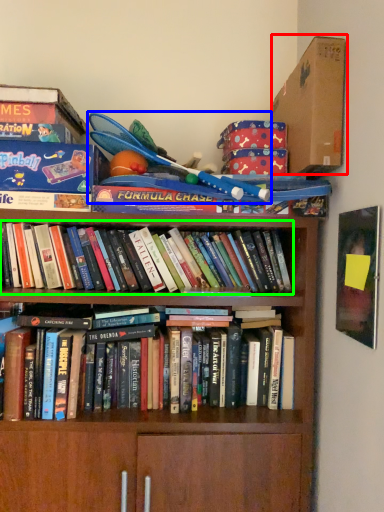
Question: Which object is the farthest from cardboard box (highlighted by a red box)? Choose among these: toy (highlighted by a blue box) or book (highlighted by a green box).

Choices:
 (A) toy
 (B) book

Answer: (B)